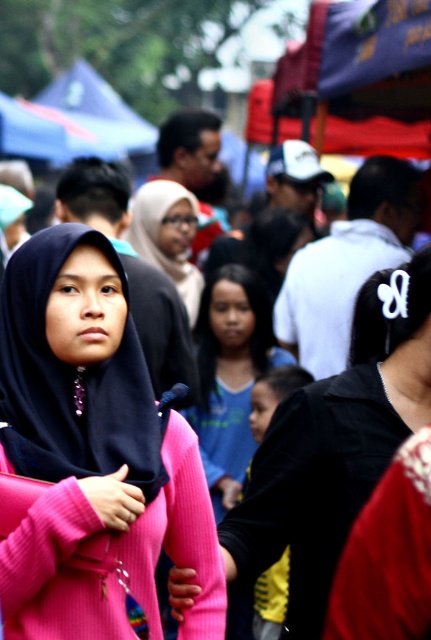
Question: Which of the following is the farthest from the observer?

Choices:
 (A) pink matte sweater at center
 (B) pink ribbed sweater at center

Answer: (B)

Question: In this image, where is pink matte sweater at center located relative to pink ribbed sweater at center?

Choices:
 (A) right
 (B) left

Answer: (B)

Question: Among these objects, which one is farthest from the camera?

Choices:
 (A) pink matte sweater at center
 (B) pink ribbed sweater at center

Answer: (B)

Question: Which object is farther from the camera taking this photo?

Choices:
 (A) pink ribbed sweater at center
 (B) pink matte sweater at center

Answer: (A)

Question: Is pink matte sweater at center in front of pink ribbed sweater at center?

Choices:
 (A) yes
 (B) no

Answer: (A)

Question: Is pink matte sweater at center bigger than pink ribbed sweater at center?

Choices:
 (A) no
 (B) yes

Answer: (A)